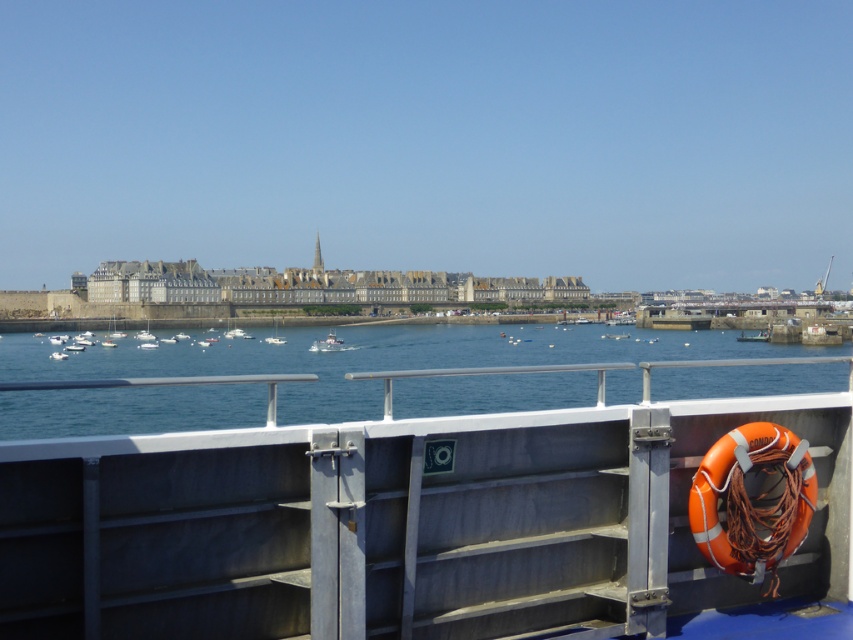
Question: Does blue water at center have a greater width compared to white plastic boat at center?

Choices:
 (A) yes
 (B) no

Answer: (A)

Question: Is orange rubber life jacket at right to the right of white plastic boat at center from the viewer's perspective?

Choices:
 (A) yes
 (B) no

Answer: (A)

Question: Considering the real-world distances, which object is closest to the white plastic boat at center?

Choices:
 (A) orange rubber boat at center
 (B) blue water at center

Answer: (B)

Question: Does blue water at center lie in front of orange rubber boat at center?

Choices:
 (A) no
 (B) yes

Answer: (B)

Question: Which object appears farthest from the camera in this image?

Choices:
 (A) metallic gray deck at center
 (B) blue water at center
 (C) orange rubber boat at center
 (D) white plastic boat at center

Answer: (C)

Question: Which object is positioned farthest from the blue water at center?

Choices:
 (A) orange rubber life jacket at right
 (B) white plastic boat at center
 (C) metallic gray deck at center

Answer: (C)